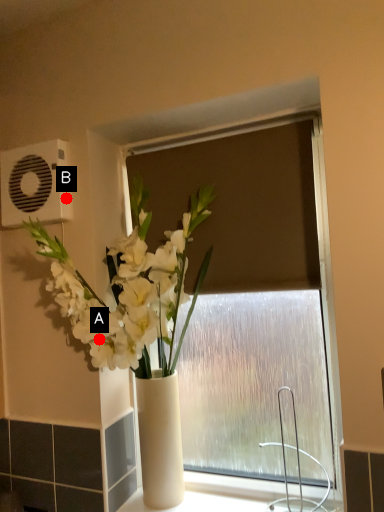
Question: Two points are circled on the image, labeled by A and B beside each circle. Which point is farther to the camera?

Choices:
 (A) A is further
 (B) B is further

Answer: (B)